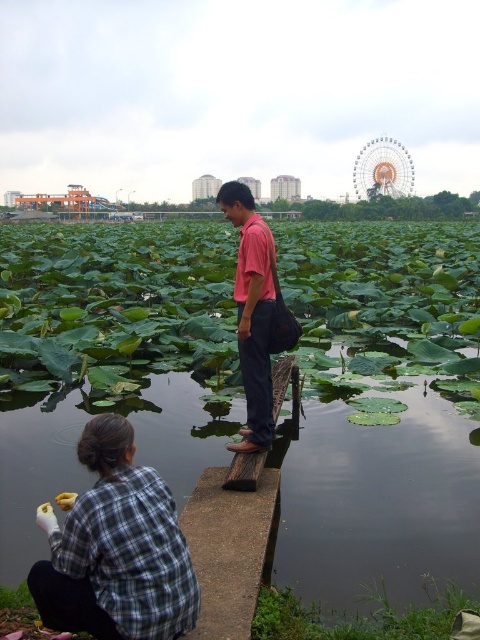
You are a photographer planning to take a portrait of the two people in the scene. Considering their positions and the height difference between the plaid fabric shirt at lower left and the pink matte shirt at center, which person should you position closer to the camera to ensure both are visible in the frame without cropping?

You should position the person wearing the plaid fabric shirt at lower left closer to the camera because they are shorter in height compared to the pink matte shirt at center, ensuring both are visible without cropping.

Looking at this image, you are a photographer trying to capture both the plaid fabric shirt at lower left and the pink matte shirt at center in a single shot. Based on their positions, which shirt would appear closer to the camera in the photo?

The plaid fabric shirt at lower left appears closer to the camera because it is positioned under the pink matte shirt at center, indicating it is in front spatially.